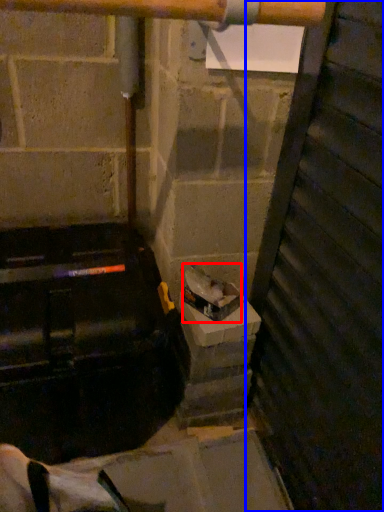
Question: Which object is further to the camera taking this photo, garbage (highlighted by a red box) or door (highlighted by a blue box)?

Choices:
 (A) garbage
 (B) door

Answer: (A)